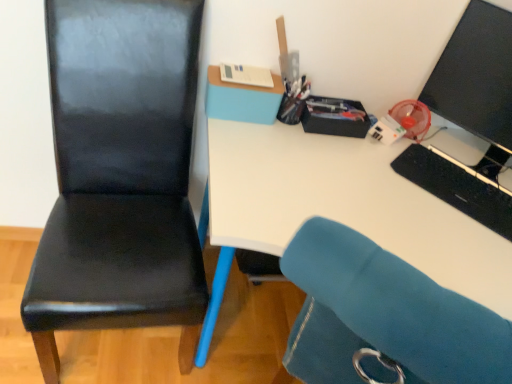
You are a GUI agent. You are given a task and a screenshot of the screen. Output one action in this format:
    pyautogui.click(x=<x>, y=<y>)
    Task: Click on the free spot in front of matte black stationery box at upper right, the third stationery from the left
    This screenshot has width=512, height=384.
    Given the screenshot: What is the action you would take?
    pyautogui.click(x=331, y=157)